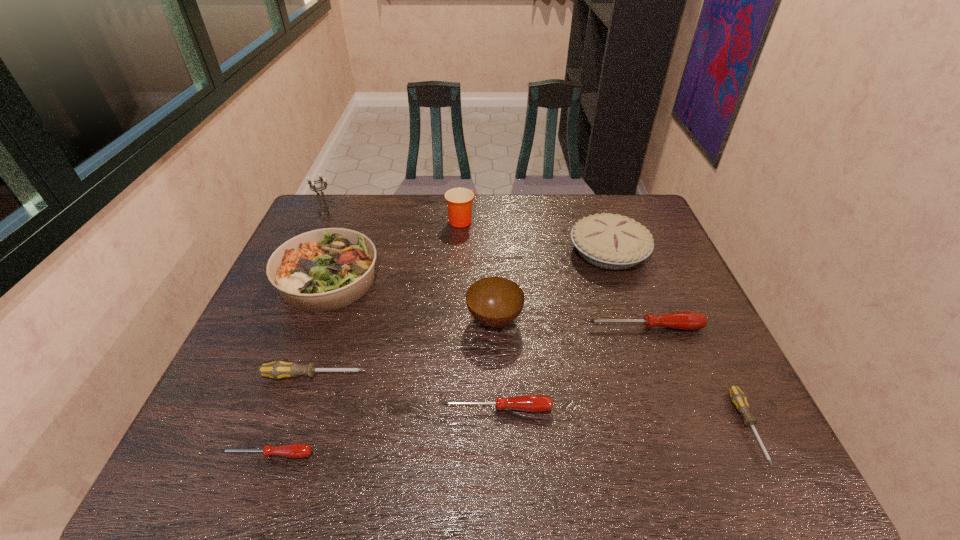
The height and width of the screenshot is (540, 960). Find the location of `vacant area that lies between the third screwdriver from right to left and the right gray screwdriver`. vacant area that lies between the third screwdriver from right to left and the right gray screwdriver is located at coordinates (622, 417).

Locate an element on the screen. vacant region between the leftmost red screwdriver and the nearer gray screwdriver is located at coordinates (508, 441).

Find the location of a particular element. vacant space that is in between the pie and the bowl is located at coordinates (551, 286).

The image size is (960, 540). I want to click on free spot between the farther gray screwdriver and the farthest screwdriver, so click(479, 352).

At what (x,y) coordinates should I click in order to perform the action: click on vacant area between the farthest red screwdriver and the right gray screwdriver. Please return your answer as a coordinate pair (x, y). The width and height of the screenshot is (960, 540). Looking at the image, I should click on (696, 377).

Locate an element on the screen. free space between the pie and the smaller gray screwdriver is located at coordinates (678, 339).

You are a GUI agent. You are given a task and a screenshot of the screen. Output one action in this format:
    pyautogui.click(x=<x>, y=<y>)
    Task: Click on the empty location between the tallest object and the cup
    
    Given the screenshot: What is the action you would take?
    pyautogui.click(x=393, y=216)

Find the location of a particular element. The image size is (960, 540). vacant area between the candle holder and the shortest object is located at coordinates (297, 334).

Identify the location of free space between the bigger gray screwdriver and the farthest screwdriver. (479, 352).

Identify the location of free point between the farthest red screwdriver and the right gray screwdriver. This screenshot has width=960, height=540. (696, 377).